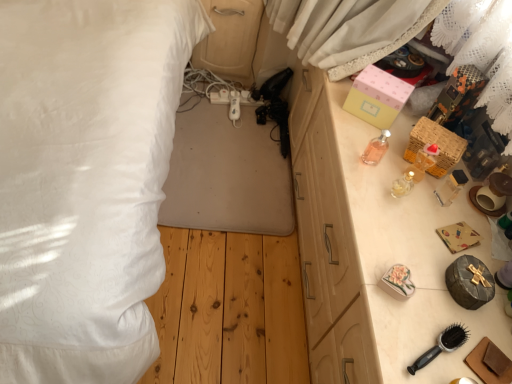
Locate an element on the screen. The image size is (512, 384). vacant space in front of woven wicker basket at right, arranged as the first box when ordered from the bottom is located at coordinates (419, 198).